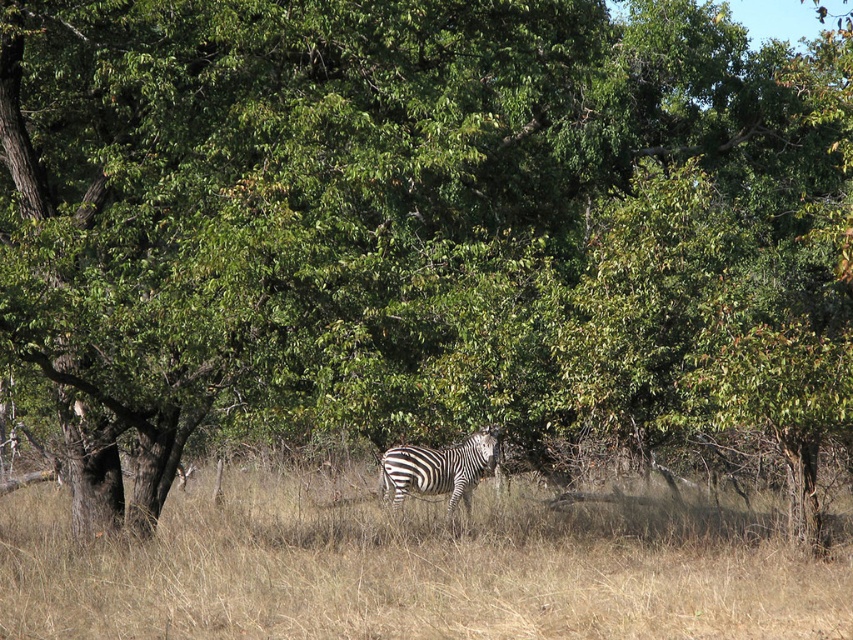
Question: Can you confirm if dry grass at center is positioned below black and white striped zebra at center?

Choices:
 (A) yes
 (B) no

Answer: (A)

Question: Which of the following is the farthest from the observer?

Choices:
 (A) (397, 472)
 (B) (543, 595)

Answer: (A)

Question: Does dry grass at center appear under black and white striped zebra at center?

Choices:
 (A) yes
 (B) no

Answer: (A)

Question: Considering the relative positions of dry grass at center and black and white striped zebra at center in the image provided, where is dry grass at center located with respect to black and white striped zebra at center?

Choices:
 (A) left
 (B) right

Answer: (A)